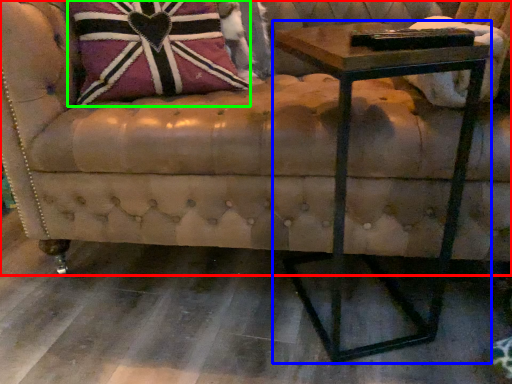
Question: Estimate the real-world distances between objects in this image. Which object is farther from studio couch (highlighted by a red box), table (highlighted by a blue box) or throw pillow (highlighted by a green box)?

Choices:
 (A) table
 (B) throw pillow

Answer: (B)